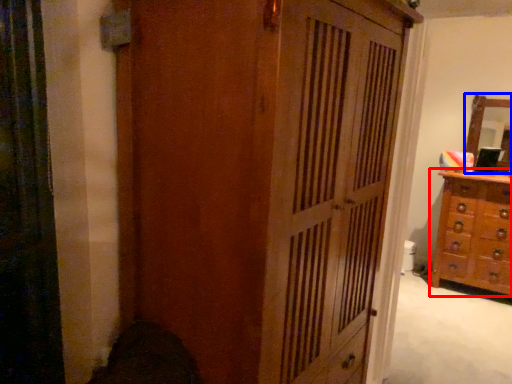
Question: Which point is further to the camera, chest of drawers (highlighted by a red box) or mirror (highlighted by a blue box)?

Choices:
 (A) chest of drawers
 (B) mirror

Answer: (B)